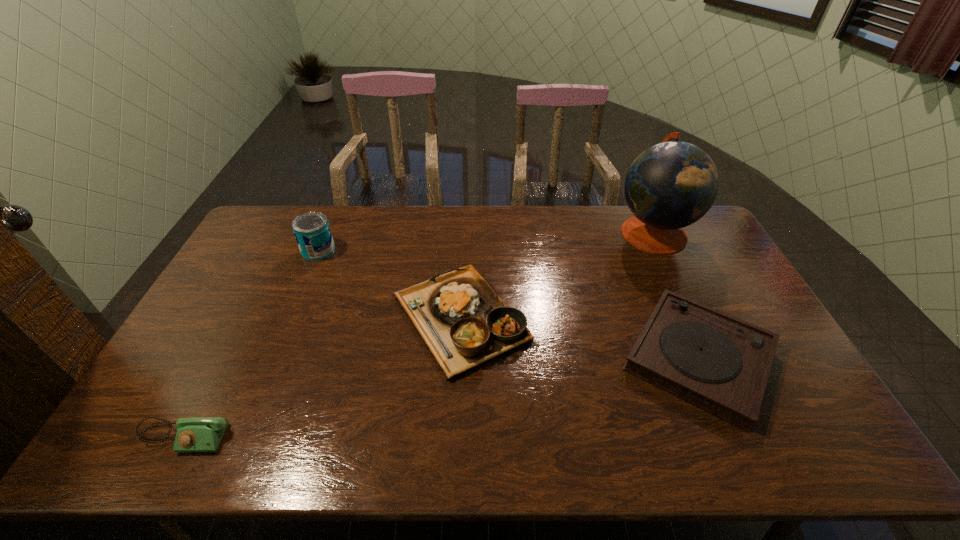
This screenshot has width=960, height=540. Find the location of `object located at the far right corner`. object located at the far right corner is located at coordinates (671, 185).

This screenshot has height=540, width=960. In order to click on object that is at the near right corner in this screenshot , I will do `click(716, 362)`.

The height and width of the screenshot is (540, 960). What are the coordinates of `blank space at the far edge of the desktop` in the screenshot? It's located at (533, 210).

You are a GUI agent. You are given a task and a screenshot of the screen. Output one action in this format:
    pyautogui.click(x=<x>, y=<y>)
    Task: Click on the vacant space at the near edge
    The image size is (960, 540).
    Given the screenshot: What is the action you would take?
    pyautogui.click(x=295, y=424)

Where is `free space at the left edge of the desktop`? free space at the left edge of the desktop is located at coordinates (233, 278).

This screenshot has width=960, height=540. Find the location of `free location at the right edge`. free location at the right edge is located at coordinates (790, 417).

The image size is (960, 540). In the image, there is a desktop. Identify the location of vacant space at the far left corner. (266, 244).

Locate an element on the screen. This screenshot has height=540, width=960. free spot at the near left corner of the desktop is located at coordinates (141, 439).

Image resolution: width=960 pixels, height=540 pixels. I want to click on free space between the fourth shortest object and the phonograph record, so click(x=509, y=304).

The height and width of the screenshot is (540, 960). What are the coordinates of `vacant area between the telephone and the can` in the screenshot? It's located at (252, 343).